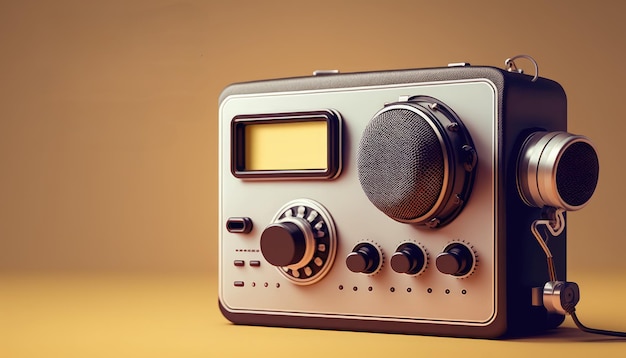
The image size is (626, 358). Find the location of `screen`. screen is located at coordinates click(x=279, y=145).